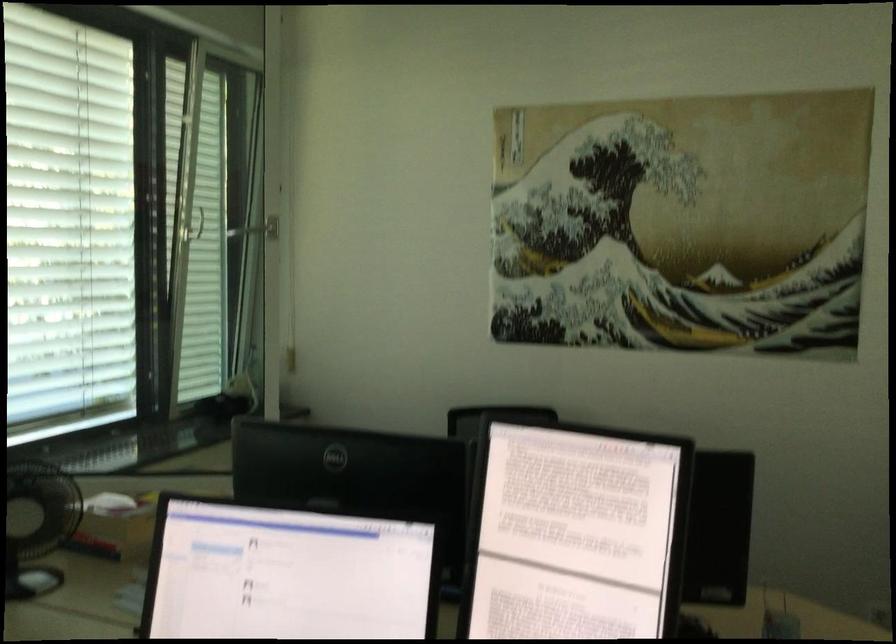
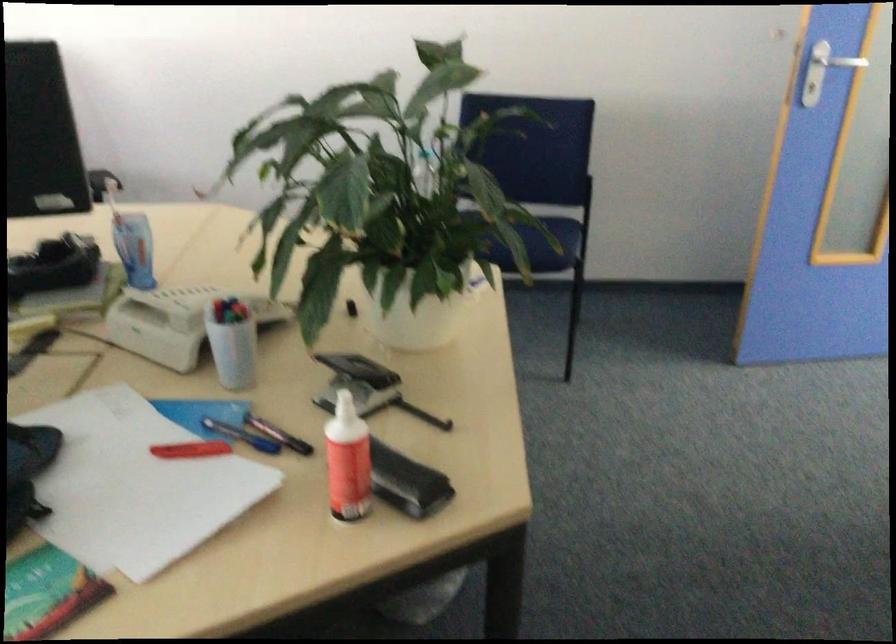
Question: Which direction would the cameraman need to move to produce the second image? Reply with the corresponding letter.

Choices:
 (A) Left
 (B) Right
 (C) Forward
 (D) Backward

Answer: (B)